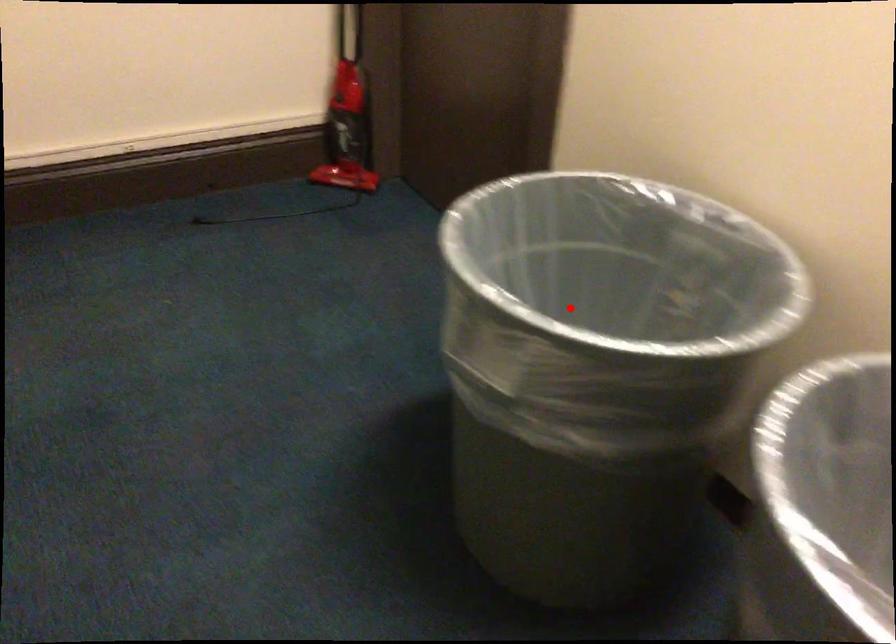
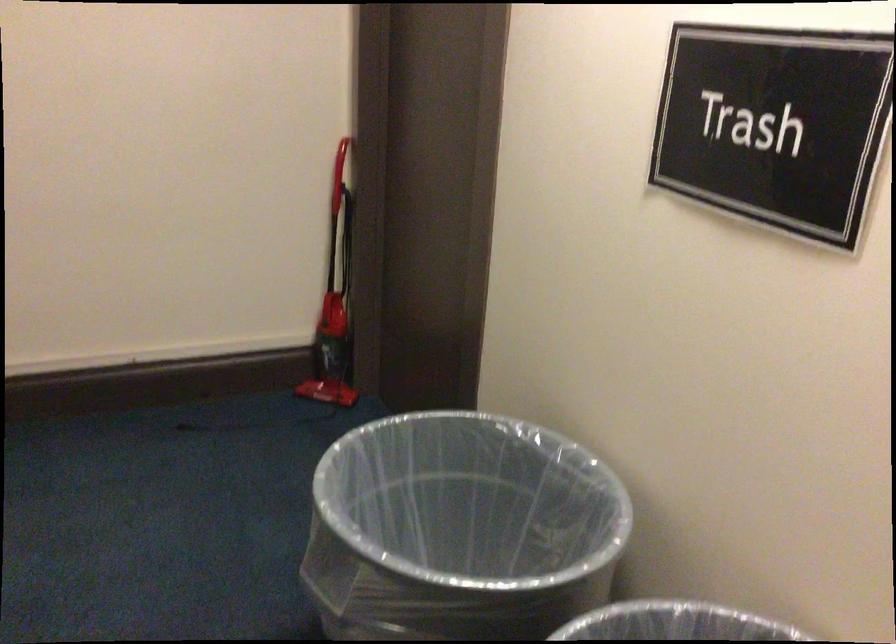
In the second image, find the point that corresponds to the highlighted location in the first image.

(460, 529)